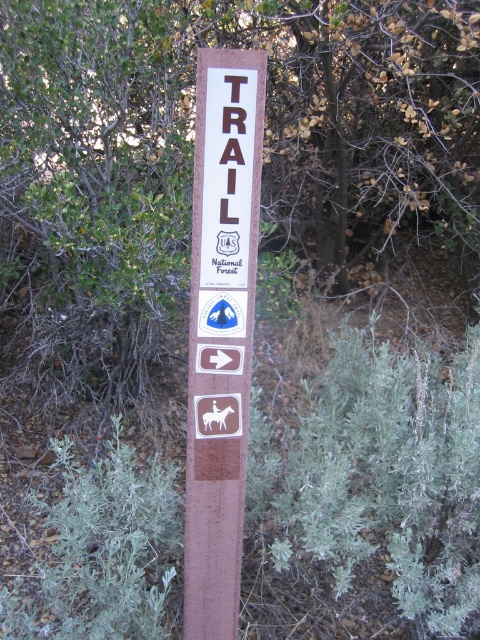
Which is more to the right, green leafy tree at center or brown wood trail sign at center?

green leafy tree at center is more to the right.

Does point (41, 285) lie behind point (197, 248)?

That is True.

In order to click on green leafy tree at center in this screenshot , I will do `click(191, 163)`.